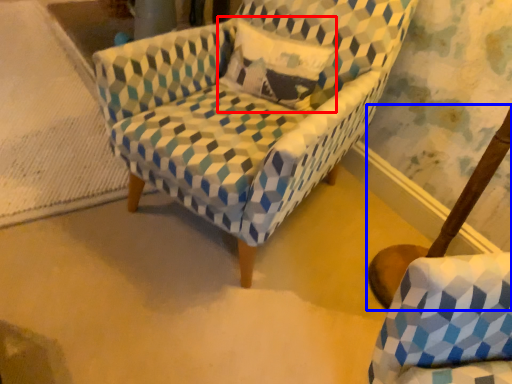
Question: Which object appears closest to the camera in this image, throw pillow (highlighted by a red box) or swivel chair (highlighted by a blue box)?

Choices:
 (A) throw pillow
 (B) swivel chair

Answer: (A)